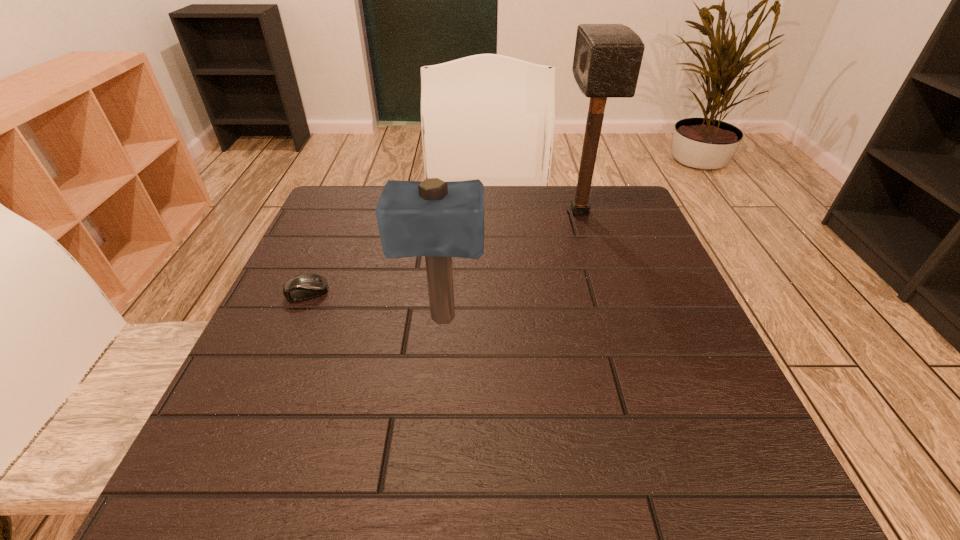
Find the location of a particular element. object present at the left edge is located at coordinates (305, 286).

Identify the location of object at the right edge. The height and width of the screenshot is (540, 960). (607, 58).

Locate an element on the screen. The width and height of the screenshot is (960, 540). object that is at the far right corner is located at coordinates (607, 58).

In order to click on free space at the far edge of the desktop in this screenshot , I will do `click(492, 234)`.

Identify the location of free space at the near edge of the desktop. (590, 458).

Identify the location of free spot at the left edge of the desktop. The width and height of the screenshot is (960, 540). (290, 361).

Where is `vacant space at the right edge`? vacant space at the right edge is located at coordinates (653, 255).

Find the location of a particular element. Image resolution: width=960 pixels, height=540 pixels. vacant region at the far left corner of the desktop is located at coordinates (327, 199).

At what (x,y) coordinates should I click in order to perform the action: click on vacant space at the near left corner. Please return your answer as a coordinate pair (x, y). Image resolution: width=960 pixels, height=540 pixels. Looking at the image, I should click on (283, 456).

You are a GUI agent. You are given a task and a screenshot of the screen. Output one action in this format:
    pyautogui.click(x=<x>, y=<y>)
    Task: Click on the vacant space at the far right corner
    The height and width of the screenshot is (540, 960).
    Given the screenshot: What is the action you would take?
    pyautogui.click(x=640, y=216)